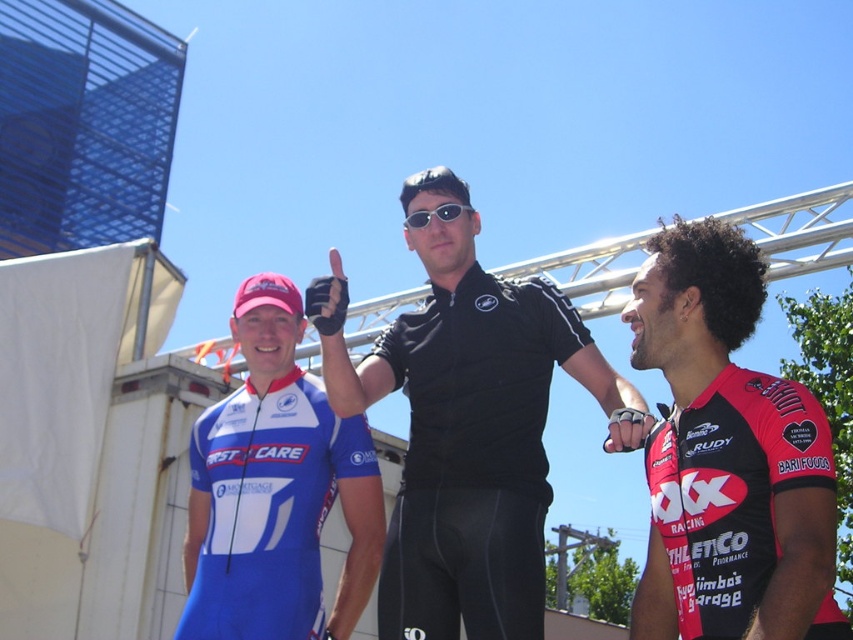
You are organizing a cycling event and need to ensure that the black matte shirt at center and the red matte jersey at right can fit into a storage box. The box has a capacity that can only accommodate items up to the size of the larger of the two. Which item determines the minimum required size for the box?

The black matte shirt at center is bigger than the red matte jersey at right, so the minimum required size for the box must be at least as large as the black matte shirt at center to accommodate both items.